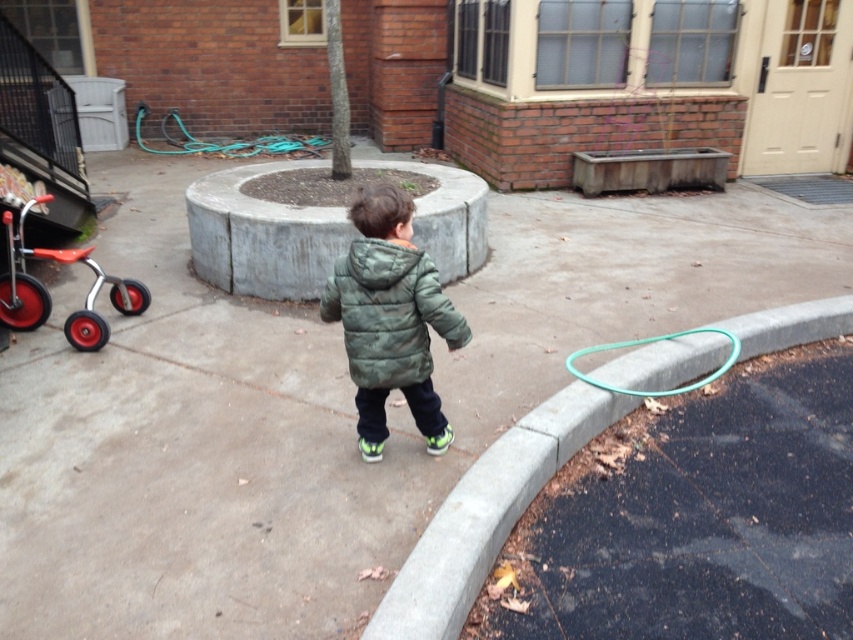
You are a delivery person trying to place a small package on the gray concrete curb at lower right. However, you notice the green rubber garden hose at lower left nearby. Considering their heights, which object is more suitable to place the package on?

The gray concrete curb at lower right is much taller than the green rubber garden hose at lower left, so the curb is more suitable to place the package on because it is higher and more stable.

From the picture: You are standing at the point with coordinates point (360, 376) and want to walk towards the point (26, 321). According to the scene, which direction should you face to move towards the second point?

To move from point (360, 376) to point (26, 321), you should face downwards because point (26, 321) is further away from the viewer compared to point (360, 376).

You are a photographer trying to capture the green quilted jacket at center and the green rubber garden hose at lower right in the same frame. Based on their positions, which object should you focus on first to ensure both are in focus?

The green quilted jacket at center is above the green rubber garden hose at lower right, so you should focus on the green quilted jacket at center first to ensure both are in focus.